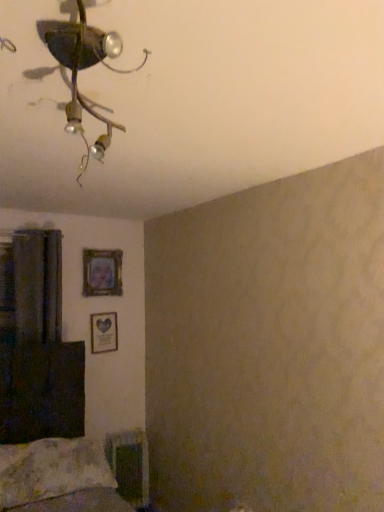
Question: From a real-world perspective, is metallic ceiling fixture at upper left beneath dark brown fabric curtain at left?

Choices:
 (A) yes
 (B) no

Answer: (B)

Question: Is metallic ceiling fixture at upper left wider than dark brown fabric curtain at left?

Choices:
 (A) yes
 (B) no

Answer: (A)

Question: Can you confirm if metallic ceiling fixture at upper left is positioned to the left of dark brown fabric curtain at left?

Choices:
 (A) no
 (B) yes

Answer: (A)

Question: Can you confirm if metallic ceiling fixture at upper left is positioned to the right of dark brown fabric curtain at left?

Choices:
 (A) no
 (B) yes

Answer: (B)

Question: Would you say metallic ceiling fixture at upper left is outside dark brown fabric curtain at left?

Choices:
 (A) yes
 (B) no

Answer: (A)

Question: Is metallic ceiling fixture at upper left bigger than dark brown fabric curtain at left?

Choices:
 (A) yes
 (B) no

Answer: (B)

Question: Is fluffy white pillow at lower left shorter than matte wooden picture frame at upper left, which is the second picture frame in bottom-to-top order?

Choices:
 (A) no
 (B) yes

Answer: (B)

Question: Is fluffy white pillow at lower left smaller than matte wooden picture frame at upper left, which is the second picture frame in bottom-to-top order?

Choices:
 (A) no
 (B) yes

Answer: (A)

Question: Is fluffy white pillow at lower left oriented away from matte wooden picture frame at upper left, acting as the 1th picture frame starting from the top?

Choices:
 (A) yes
 (B) no

Answer: (B)

Question: Is fluffy white pillow at lower left to the left of matte wooden picture frame at upper left, acting as the 1th picture frame starting from the top, from the viewer's perspective?

Choices:
 (A) yes
 (B) no

Answer: (A)

Question: Is fluffy white pillow at lower left not near matte wooden picture frame at upper left, acting as the 1th picture frame starting from the top?

Choices:
 (A) yes
 (B) no

Answer: (A)

Question: Considering the relative positions of fluffy white pillow at lower left and matte wooden picture frame at upper left, which is the second picture frame in bottom-to-top order, in the image provided, is fluffy white pillow at lower left to the right of matte wooden picture frame at upper left, which is the second picture frame in bottom-to-top order, from the viewer's perspective?

Choices:
 (A) yes
 (B) no

Answer: (B)

Question: Is metallic ceiling fixture at upper left bigger than matte wooden picture frame at upper left, acting as the 1th picture frame starting from the top?

Choices:
 (A) yes
 (B) no

Answer: (A)